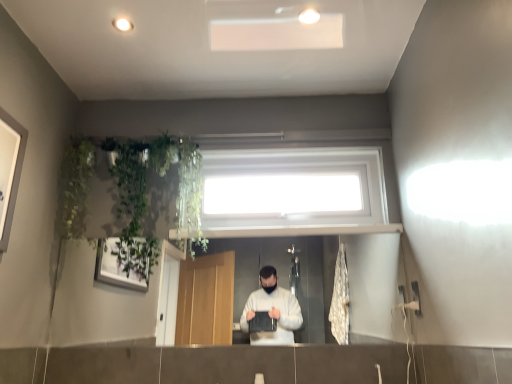
The image size is (512, 384). Describe the element at coordinates (294, 192) in the screenshot. I see `white plastic window at upper center` at that location.

I want to click on white plastic window at upper center, so click(x=294, y=192).

What is the approximate height of white plastic window at upper center?

white plastic window at upper center is 18.81 inches tall.

Describe the element at coordinates (74, 187) in the screenshot. The width and height of the screenshot is (512, 384). I see `green leafy plant at upper left` at that location.

Measure the distance between point (x=84, y=160) and camera.

They are 6.89 feet apart.

I want to click on green leafy plant at upper left, so click(x=74, y=187).

At what (x,y) coordinates should I click in order to perform the action: click on white plastic window at upper center. Please return your answer as a coordinate pair (x, y). Image resolution: width=512 pixels, height=384 pixels. Looking at the image, I should click on (294, 192).

Based on the photo, which object is positioned more to the left, white plastic window at upper center or green leafy plant at upper left?

green leafy plant at upper left.

Which is in front, white plastic window at upper center or green leafy plant at upper left?

green leafy plant at upper left is closer to the camera.

Considering the positions of point (368, 197) and point (76, 163), is point (368, 197) closer or farther from the camera than point (76, 163)?

Point (368, 197).

From the image's perspective, which one is positioned lower, white plastic window at upper center or green leafy plant at upper left?

green leafy plant at upper left appears lower in the image.

From a real-world perspective, is white plastic window at upper center physically above green leafy plant at upper left?

Yes, from a real-world perspective, white plastic window at upper center is on top of green leafy plant at upper left.

Considering the sizes of objects white plastic window at upper center and green leafy plant at upper left in the image provided, who is thinner, white plastic window at upper center or green leafy plant at upper left?

Thinner between the two is white plastic window at upper center.

Looking at this image, who is taller, white plastic window at upper center or green leafy plant at upper left?

green leafy plant at upper left.

Which of these two, white plastic window at upper center or green leafy plant at upper left, is smaller?

green leafy plant at upper left.

Would you say white plastic window at upper center contains green leafy plant at upper left?

No, green leafy plant at upper left is not inside white plastic window at upper center.

Consider the image. Is white plastic window at upper center beside green leafy plant at upper left?

No, white plastic window at upper center is not beside green leafy plant at upper left.

Based on the photo, is green leafy plant at upper left at the back of white plastic window at upper center?

No, white plastic window at upper center's orientation is not away from green leafy plant at upper left.

At what (x,y) coordinates should I click in order to perform the action: click on window located on the right of green leafy plant at upper left. Please return your answer as a coordinate pair (x, y). The image size is (512, 384). Looking at the image, I should click on (294, 192).

Is green leafy plant at upper left at the right side of white plastic window at upper center?

Incorrect, green leafy plant at upper left is not on the right side of white plastic window at upper center.

Which object is more forward, green leafy plant at upper left or white plastic window at upper center?

green leafy plant at upper left is closer to the camera.

Is point (72, 176) closer to camera compared to point (330, 203)?

Yes, it is in front of point (330, 203).

From the image's perspective, which is below, green leafy plant at upper left or white plastic window at upper center?

green leafy plant at upper left is shown below in the image.

From a real-world perspective, is green leafy plant at upper left beneath white plastic window at upper center?

Yes, from a real-world perspective, green leafy plant at upper left is below white plastic window at upper center.

In terms of width, does green leafy plant at upper left look wider or thinner when compared to white plastic window at upper center?

In the image, green leafy plant at upper left appears to be wider than white plastic window at upper center.

Is green leafy plant at upper left taller than white plastic window at upper center?

Yes.

Looking at this image, between green leafy plant at upper left and white plastic window at upper center, which one has larger size?

Bigger between the two is white plastic window at upper center.

Is green leafy plant at upper left inside or outside of white plastic window at upper center?

green leafy plant at upper left cannot be found inside white plastic window at upper center.

Are green leafy plant at upper left and white plastic window at upper center beside each other?

green leafy plant at upper left and white plastic window at upper center are not in contact.

Is green leafy plant at upper left facing away from white plastic window at upper center?

No, green leafy plant at upper left's orientation is not away from white plastic window at upper center.

How distant is green leafy plant at upper left from white plastic window at upper center?

green leafy plant at upper left is 38.15 inches away from white plastic window at upper center.

Locate an element on the screen. This screenshot has height=384, width=512. plant located below the white plastic window at upper center (from the image's perspective) is located at coordinates (74, 187).

Identify the location of window lying on the right of green leafy plant at upper left. (294, 192).

This screenshot has height=384, width=512. In order to click on window above the green leafy plant at upper left (from the image's perspective) in this screenshot , I will do `click(294, 192)`.